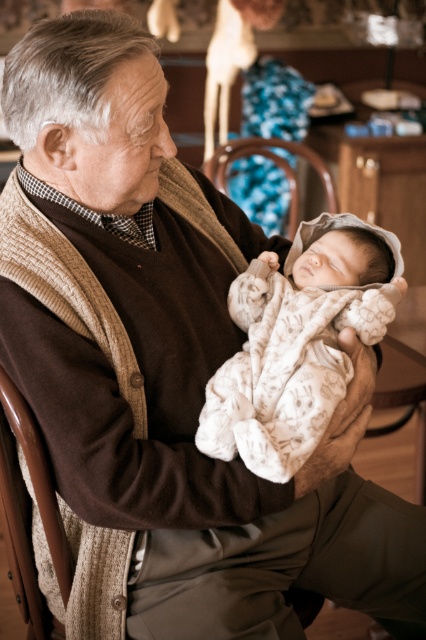
Can you confirm if white soft fabric newborn at center is positioned above wooden chair at center?

Incorrect, white soft fabric newborn at center is not positioned above wooden chair at center.

Between white soft fabric newborn at center and wooden chair at center, which one appears on the left side from the viewer's perspective?

From the viewer's perspective, white soft fabric newborn at center appears more on the left side.

Is point (290, 336) closer to viewer compared to point (281, 156)?

Yes, it is in front of point (281, 156).

Identify the location of white soft fabric newborn at center. point(298,342).